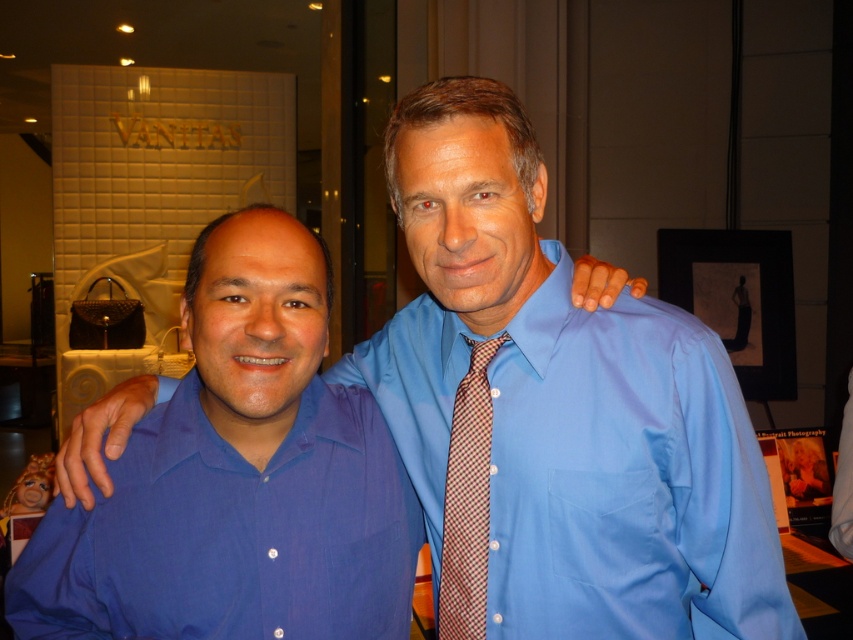
You are a tailor who needs to adjust the fit of the blue cotton shirt at center and the plaid silk tie at center. Which item requires a wider fabric width to accommodate its current size?

The blue cotton shirt at center requires a wider fabric width because its width is larger than the plaid silk tie at center.

You are a photographer setting up a shoot in the described scene. You need to ensure that the blue satin shirt at center and the plaid silk tie at center are both visible in the frame. Given their sizes, which item will require more horizontal space in the camera frame?

The blue satin shirt at center requires more horizontal space in the camera frame because its width surpasses that of the plaid silk tie at center.